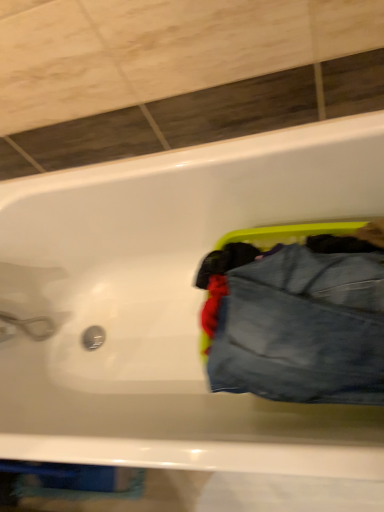
Question: Should I look upward or downward to see denim at right?

Choices:
 (A) up
 (B) down

Answer: (B)

Question: Is white glossy bathtub at upper center positioned beyond the bounds of denim at right?

Choices:
 (A) yes
 (B) no

Answer: (A)

Question: Is denim at right at the back of white glossy bathtub at upper center?

Choices:
 (A) no
 (B) yes

Answer: (B)

Question: Can you see white glossy bathtub at upper center touching denim at right?

Choices:
 (A) no
 (B) yes

Answer: (A)

Question: Are white glossy bathtub at upper center and denim at right far apart?

Choices:
 (A) yes
 (B) no

Answer: (B)

Question: Considering the relative sizes of white glossy bathtub at upper center and denim at right in the image provided, is white glossy bathtub at upper center shorter than denim at right?

Choices:
 (A) yes
 (B) no

Answer: (B)

Question: From a real-world perspective, is white glossy bathtub at upper center on denim at right?

Choices:
 (A) yes
 (B) no

Answer: (B)

Question: Can you confirm if denim at right is positioned to the right of white glossy bathtub at upper center?

Choices:
 (A) no
 (B) yes

Answer: (B)

Question: Is white glossy bathtub at upper center at the back of denim at right?

Choices:
 (A) yes
 (B) no

Answer: (A)

Question: Is denim at right surrounding white glossy bathtub at upper center?

Choices:
 (A) no
 (B) yes

Answer: (A)

Question: Considering the relative sizes of denim at right and white glossy bathtub at upper center in the image provided, is denim at right taller than white glossy bathtub at upper center?

Choices:
 (A) no
 (B) yes

Answer: (A)

Question: Does denim at right have a larger size compared to white glossy bathtub at upper center?

Choices:
 (A) no
 (B) yes

Answer: (A)

Question: From a real-world perspective, is denim at right located beneath white glossy bathtub at upper center?

Choices:
 (A) yes
 (B) no

Answer: (B)

Question: Based on their positions, is denim at right located to the left or right of white glossy bathtub at upper center?

Choices:
 (A) left
 (B) right

Answer: (B)